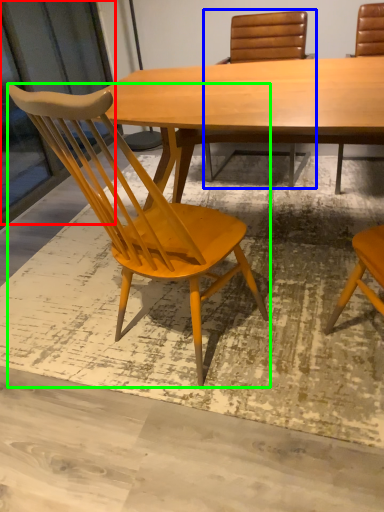
Question: Which object is the farthest from screen door (highlighted by a red box)? Choose among these: chair (highlighted by a blue box) or chair (highlighted by a green box).

Choices:
 (A) chair
 (B) chair

Answer: (B)